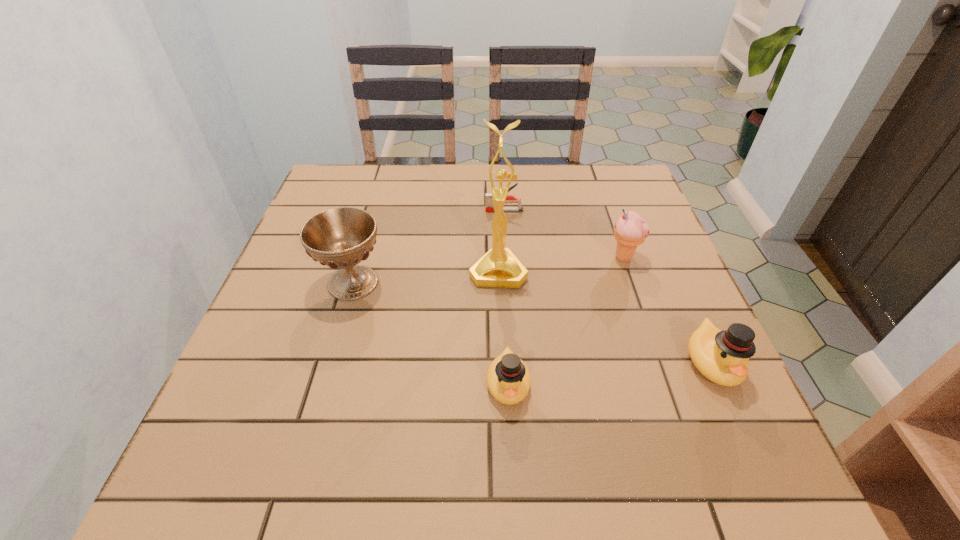
At what (x,y) coordinates should I click in order to perform the action: click on free space located on the back of the leftmost object. Please return your answer as a coordinate pair (x, y). This screenshot has width=960, height=540. Looking at the image, I should click on (371, 225).

The image size is (960, 540). I want to click on free space located 0.220m on the front of the fifth object from left to right, so click(x=654, y=343).

What are the coordinates of `free space located 0.120m on the front-facing side of the award` in the screenshot? It's located at (500, 332).

This screenshot has width=960, height=540. In order to click on object that is at the far edge in this screenshot , I will do `click(489, 206)`.

Locate an element on the screen. object that is at the left edge is located at coordinates (342, 237).

Where is `duck at the right edge`? The width and height of the screenshot is (960, 540). duck at the right edge is located at coordinates (721, 356).

Where is `icecream positioned at the right edge`? icecream positioned at the right edge is located at coordinates (630, 230).

Identify the location of object that is at the near right corner. (721, 356).

Locate an element on the screen. Image resolution: width=960 pixels, height=540 pixels. vacant space at the far edge is located at coordinates (389, 206).

The height and width of the screenshot is (540, 960). In order to click on vacant area at the near edge of the desktop in this screenshot , I will do `click(568, 422)`.